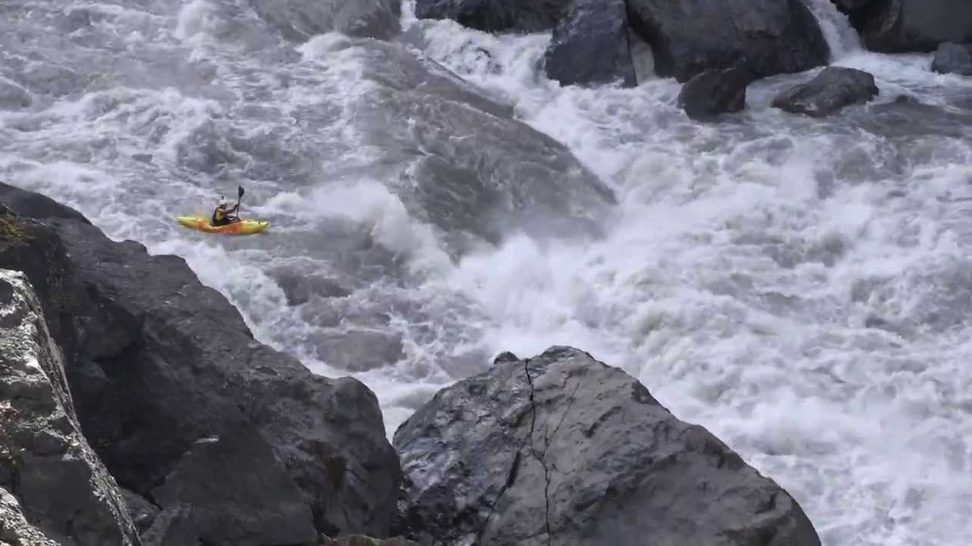
Identify the location of foam. The height and width of the screenshot is (546, 972). (791, 413), (710, 421), (519, 289).